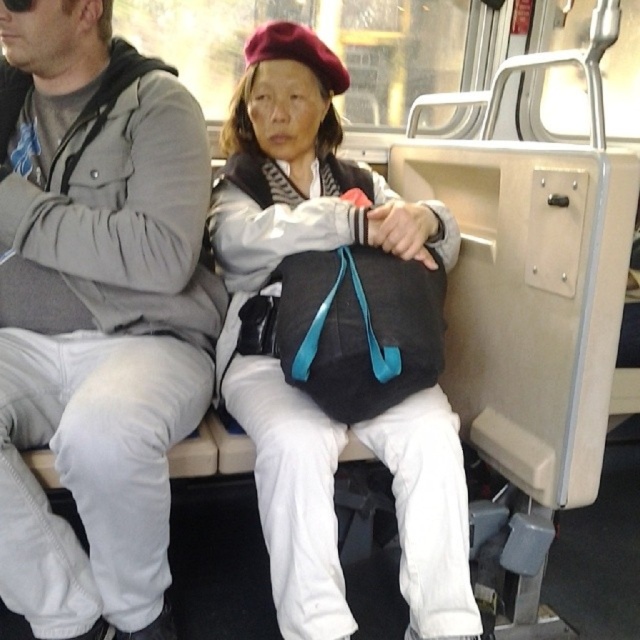
Which is in front, point (106, 4) or point (332, 545)?

Positioned in front is point (332, 545).

Is gray cotton hoodie at left bigger than matte black bag at center?

No.

Is point (177, 292) positioned in front of point (417, 225)?

Yes, it is.

Find the location of a particular element. This screenshot has width=640, height=640. gray cotton hoodie at left is located at coordinates (97, 314).